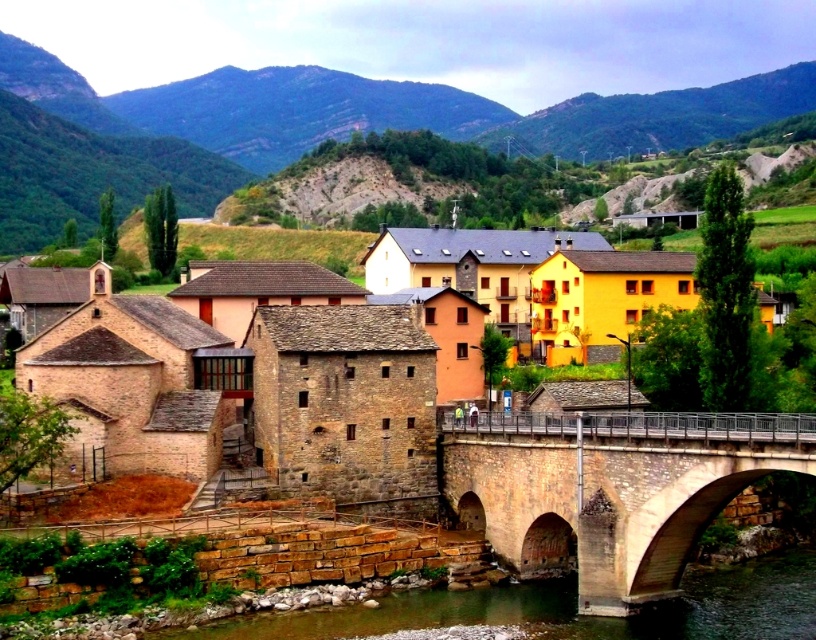
Locate an element on the screen. green grassy hillside at upper center is located at coordinates (366, 116).

Who is more distant from viewer, (x=40, y=204) or (x=617, y=433)?

The point (x=40, y=204) is more distant.

The width and height of the screenshot is (816, 640). In order to click on green grassy hillside at upper center in this screenshot , I will do pyautogui.click(x=366, y=116).

Between brown stone village at center and brown stone river at lower center, which one has less height?

brown stone river at lower center is shorter.

Which is behind, point (85, 404) or point (455, 611)?

Positioned behind is point (85, 404).

Locate an element on the screen. The width and height of the screenshot is (816, 640). brown stone village at center is located at coordinates [x=238, y=394].

Is point (211, 330) positioned before point (493, 524)?

No, (211, 330) is further to viewer.

Is brown stone village at center bigger than stone bridge at center?

Yes, brown stone village at center is bigger than stone bridge at center.

Does point (109, 440) come behind point (630, 500)?

Yes, it is behind point (630, 500).

The height and width of the screenshot is (640, 816). Find the location of `brown stone village at center`. brown stone village at center is located at coordinates (238, 394).